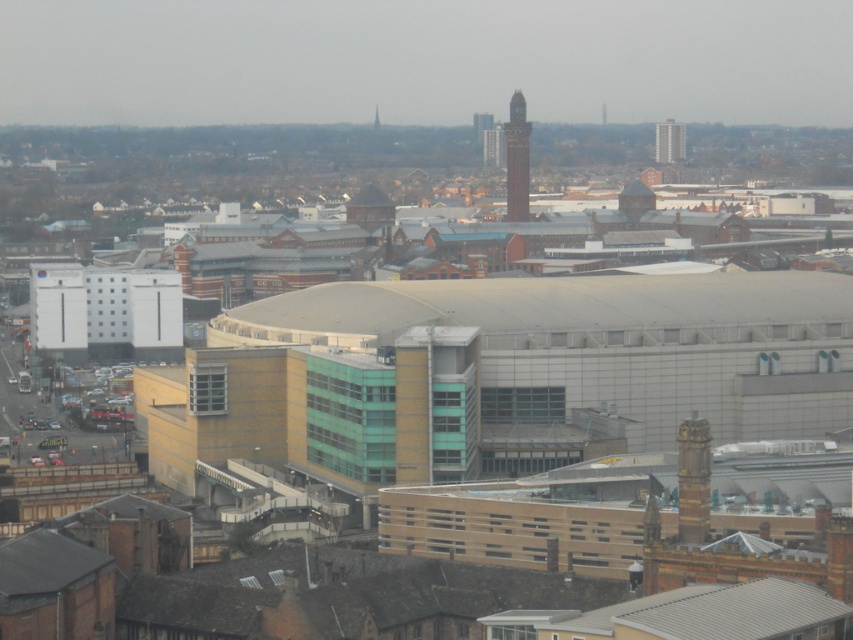
Looking at this image, you are a city planner reviewing the city layout. You see a point marked at coordinates (517, 160). Based on the scene description, what architectural feature does this point likely represent?

The point at coordinates (517, 160) corresponds to the brown brick clock tower at upper center.

Looking at the cityscape, where is the smooth glass skyscraper at upper right in relation to the brick tower at upper center?

The smooth glass skyscraper at upper right is located to the right of the brick tower at upper center.